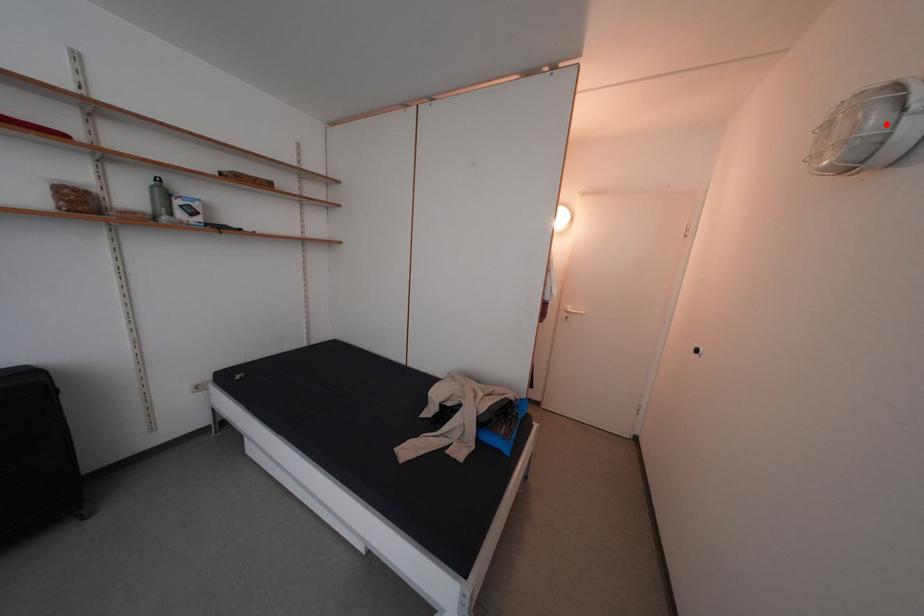
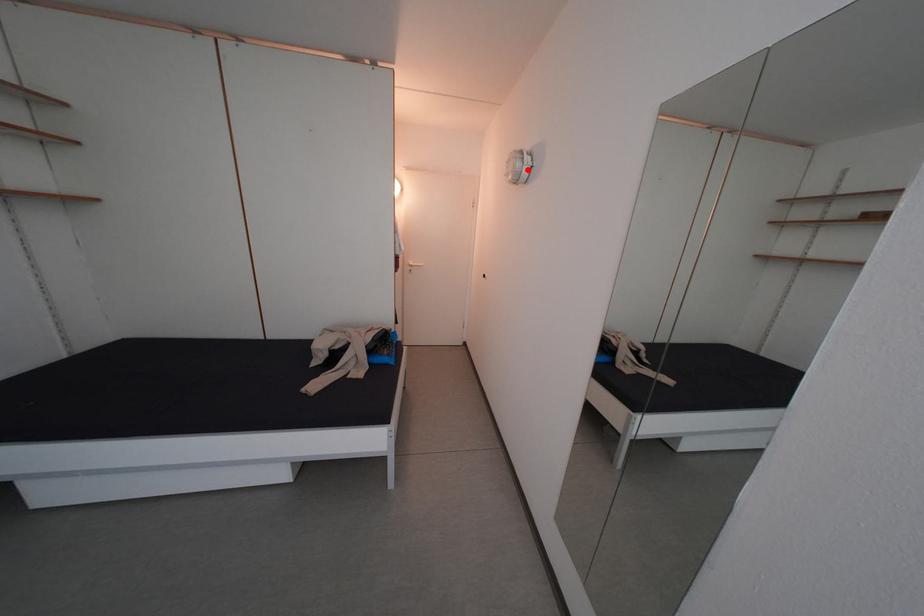
I am providing you with two images of the same scene from different viewpoints. A red point is marked on the first image and another point is marked on the second image. Is the marked point in image1 the same physical position as the marked point in image2?

Yes